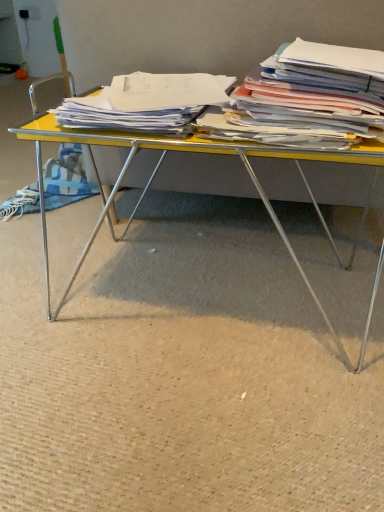
Question: Considering the relative positions of white paper at center, the second magazine viewed from the right, and yellow plastic desk at center in the image provided, is white paper at center, the second magazine viewed from the right, to the right of yellow plastic desk at center from the viewer's perspective?

Choices:
 (A) no
 (B) yes

Answer: (A)

Question: From the image's perspective, does white paper at center, which is the 1th magazine in left-to-right order, appear lower than yellow plastic desk at center?

Choices:
 (A) yes
 (B) no

Answer: (B)

Question: Does white paper at center, which is the 1th magazine in left-to-right order, have a smaller size compared to yellow plastic desk at center?

Choices:
 (A) no
 (B) yes

Answer: (B)

Question: Does white paper at center, the second magazine viewed from the right, turn towards yellow plastic desk at center?

Choices:
 (A) no
 (B) yes

Answer: (A)

Question: Is white paper at center, the second magazine viewed from the right, wider than yellow plastic desk at center?

Choices:
 (A) no
 (B) yes

Answer: (A)

Question: Is white paper at center, the second magazine viewed from the right, bigger or smaller than white paper stack at right, which is the first magazine in right-to-left order?

Choices:
 (A) small
 (B) big

Answer: (A)

Question: Considering their positions, is white paper at center, the second magazine viewed from the right, located in front of or behind white paper stack at right, which is the first magazine in right-to-left order?

Choices:
 (A) front
 (B) behind

Answer: (B)

Question: Choose the correct answer: Is white paper at center, the second magazine viewed from the right, inside white paper stack at right, which is the first magazine in right-to-left order, or outside it?

Choices:
 (A) inside
 (B) outside

Answer: (B)

Question: From the image's perspective, is white paper at center, which is the 1th magazine in left-to-right order, positioned above or below white paper stack at right, placed as the second magazine when sorted from left to right?

Choices:
 (A) above
 (B) below

Answer: (A)

Question: From their relative heights in the image, would you say yellow plastic desk at center is taller or shorter than white paper stack at right, placed as the second magazine when sorted from left to right?

Choices:
 (A) tall
 (B) short

Answer: (A)

Question: From the image's perspective, is yellow plastic desk at center positioned above or below white paper stack at right, placed as the second magazine when sorted from left to right?

Choices:
 (A) above
 (B) below

Answer: (B)

Question: Based on their sizes in the image, would you say yellow plastic desk at center is bigger or smaller than white paper stack at right, which is the first magazine in right-to-left order?

Choices:
 (A) small
 (B) big

Answer: (B)

Question: Is yellow plastic desk at center to the left or to the right of white paper stack at right, which is the first magazine in right-to-left order, in the image?

Choices:
 (A) left
 (B) right

Answer: (A)

Question: In the image, is white paper at center, the second magazine viewed from the right, on the left side or the right side of yellow plastic desk at center?

Choices:
 (A) right
 (B) left

Answer: (B)

Question: Is point (57, 119) positioned closer to the camera than point (79, 266)?

Choices:
 (A) farther
 (B) closer

Answer: (B)